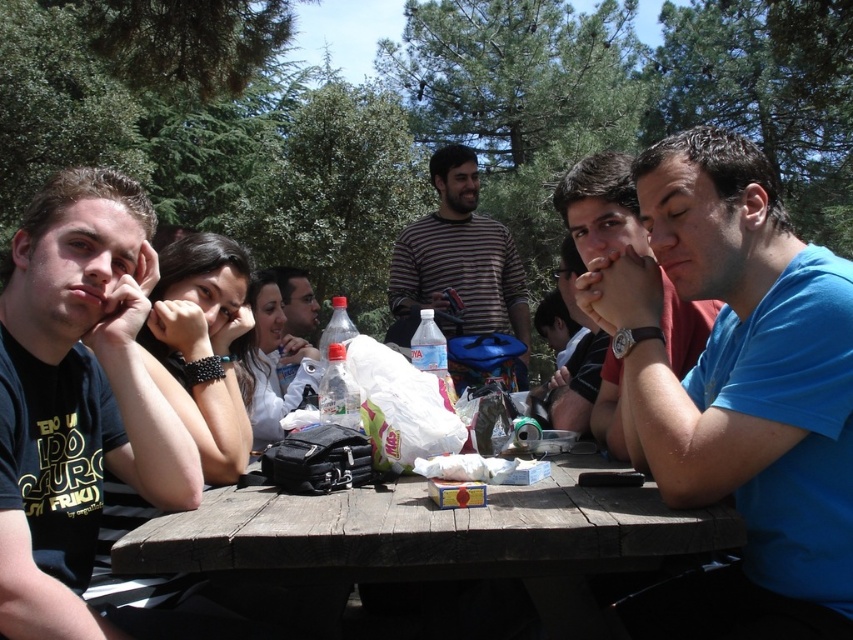
You are a photographer taking a picture of the striped cotton shirt at center and the matte black jacket at center. Which one will be in focus if you focus on the background?

The matte black jacket at center will be in focus because it is closer to the camera than the striped cotton shirt at center.

You are standing in front of the picnic table and want to place a small item on the table. There are two points marked on the table surface where you can place it. The first point is at coordinates point [486,284] and the second point is at point [285,326]. Which point is closer to you?

Point [486,284] is closer to you because it is further to the viewer than point [285,326].

You are a photographer trying to capture a candid shot of the striped cotton shirt at center and the matte black jacket at center. Since you want to focus on both items equally, which one should you position on the left side of your frame to ensure both are centered?

To ensure both the striped cotton shirt at center and the matte black jacket at center are centered in the frame while focusing on both equally, position the matte black jacket at center on the left side. This way, the striped cotton shirt at center, which is already on the right of the matte black jacket at center, will naturally align to the right, creating a balanced composition.